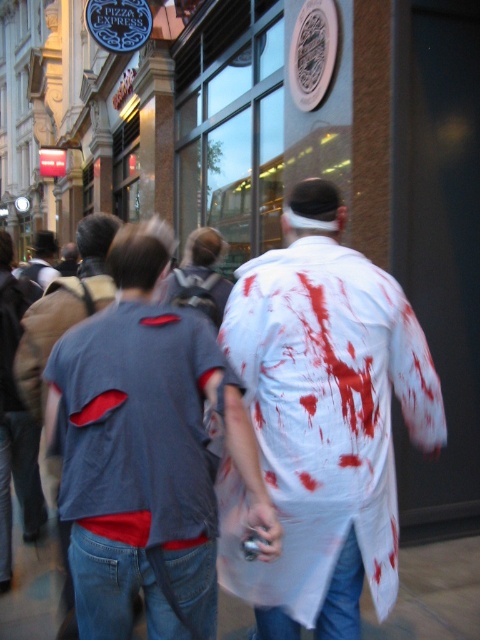
You are a photographer at the event and need to capture both the white matte shirt at center and the gray fabric shirt at center in a single frame. Based on their positions, which shirt should you focus on first to ensure both are in the shot?

The white matte shirt at center is to the right of the gray fabric shirt at center, so you should focus on the gray fabric shirt at center first to ensure both are in the shot since it is positioned to the left.

You are a photographer positioned at the front of the crowd capturing the event. You notice two participants wearing a denim shirt at center and a gray fabric shirt at center. Which participant should you focus on first to ensure they are in the foreground of your photo?

The denim shirt at center is closer to the viewer than the gray fabric shirt at center, so you should focus on the denim shirt at center first to ensure it appears in the foreground.

You are a photographer at the event and want to capture both the denim shirt at center and the gray fabric shirt at center in the same frame. Which shirt should you focus on first to ensure both are in the shot?

The denim shirt at center is located below the gray fabric shirt at center, so you should focus on the gray fabric shirt at center first to ensure both are in the shot.